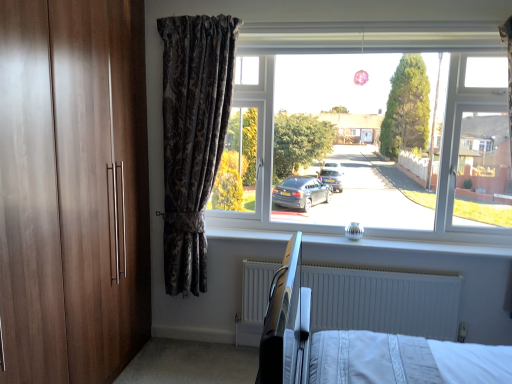
Question: Is metallic hospital bed at center wider than transparent glass window at center?

Choices:
 (A) yes
 (B) no

Answer: (A)

Question: Is metallic hospital bed at center outside transparent glass window at center?

Choices:
 (A) no
 (B) yes

Answer: (B)

Question: From a real-world perspective, is metallic hospital bed at center physically below transparent glass window at center?

Choices:
 (A) no
 (B) yes

Answer: (B)

Question: From the image's perspective, is metallic hospital bed at center on transparent glass window at center?

Choices:
 (A) no
 (B) yes

Answer: (A)

Question: Is transparent glass window at center at the back of metallic hospital bed at center?

Choices:
 (A) no
 (B) yes

Answer: (A)

Question: Considering the positions of point (375, 243) and point (509, 240), is point (375, 243) closer or farther from the camera than point (509, 240)?

Choices:
 (A) closer
 (B) farther

Answer: (B)

Question: Based on their positions, is silver metallic knob at center located to the left or right of transparent glass window at center?

Choices:
 (A) right
 (B) left

Answer: (B)

Question: Is silver metallic knob at center situated inside transparent glass window at center or outside?

Choices:
 (A) inside
 (B) outside

Answer: (B)

Question: Based on their sizes in the image, would you say silver metallic knob at center is bigger or smaller than transparent glass window at center?

Choices:
 (A) big
 (B) small

Answer: (B)

Question: Choose the correct answer: Is metallic hospital bed at center inside transparent glass window at center or outside it?

Choices:
 (A) inside
 (B) outside

Answer: (B)

Question: In terms of width, does metallic hospital bed at center look wider or thinner when compared to transparent glass window at center?

Choices:
 (A) wide
 (B) thin

Answer: (A)

Question: Is metallic hospital bed at center taller or shorter than transparent glass window at center?

Choices:
 (A) tall
 (B) short

Answer: (B)

Question: Considering the positions of point pyautogui.click(x=338, y=324) and point pyautogui.click(x=266, y=208), is point pyautogui.click(x=338, y=324) closer or farther from the camera than point pyautogui.click(x=266, y=208)?

Choices:
 (A) closer
 (B) farther

Answer: (A)

Question: Do you think silver metallic knob at center is within white textured radiator at lower center, or outside of it?

Choices:
 (A) outside
 (B) inside

Answer: (A)

Question: Is point (218, 235) closer or farther from the camera than point (424, 334)?

Choices:
 (A) farther
 (B) closer

Answer: (A)